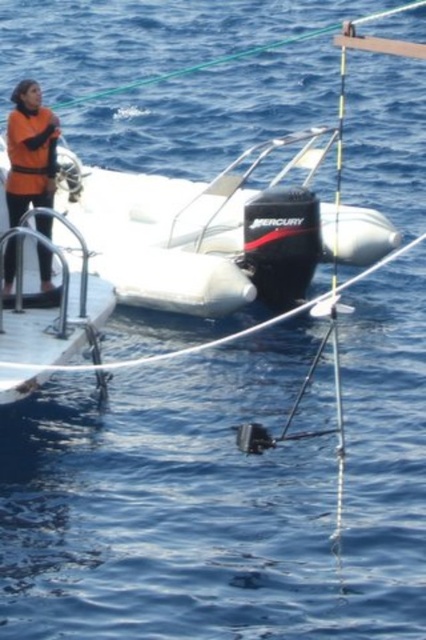
You are a sailor who needs to choose between the white rubber boat at center and the orange matte life jacket at left for a quick trip to the nearby island. Which one can you use for transportation?

The white rubber boat at center is bigger than the orange matte life jacket at left, so you can use the white rubber boat at center for transportation.

You are a sailor on the larger vessel and need to retrieve an item from the orange fleece jacket at upper left and the orange matte life jacket at left. Which item can you reach first without moving from your current position?

The orange fleece jacket at upper left is closer to the viewer than the orange matte life jacket at left, so you can reach the orange fleece jacket at upper left first without moving.